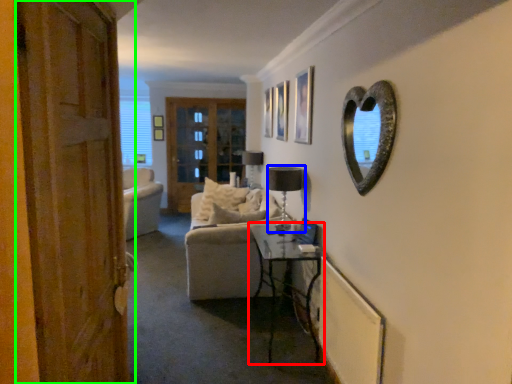
Question: Considering the real-world distances, which object is farthest from table (highlighted by a red box)? lamp (highlighted by a blue box) or door (highlighted by a green box)?

Choices:
 (A) lamp
 (B) door

Answer: (B)